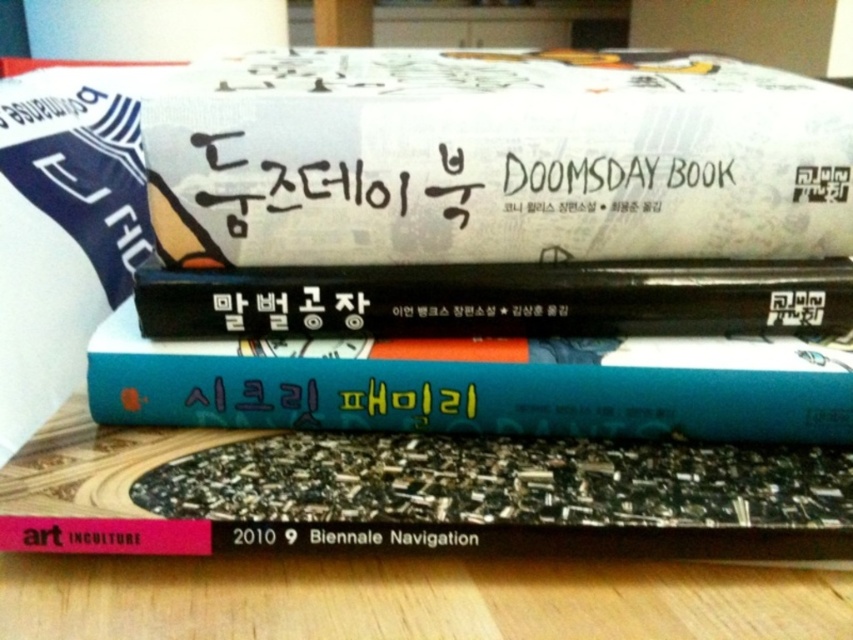
You are organizing books on a shelf and need to place both the black textured book at center and the blue matte book at center. According to the image, which book should be placed lower on the shelf?

The black textured book at center should be placed lower on the shelf because it is located below the blue matte book at center in the image.

What is the color of the book located at point (416, 493)?

The book at point (416, 493) is a black textured book at center.

You are organizing a library shelf and see two black books at the center of the stack. The books are labeled as the black textured book at center and the black matte book at center. Which one is located to the left?

The black textured book at center is positioned on the left side of the black matte book at center, so the black textured book at center is located to the left.